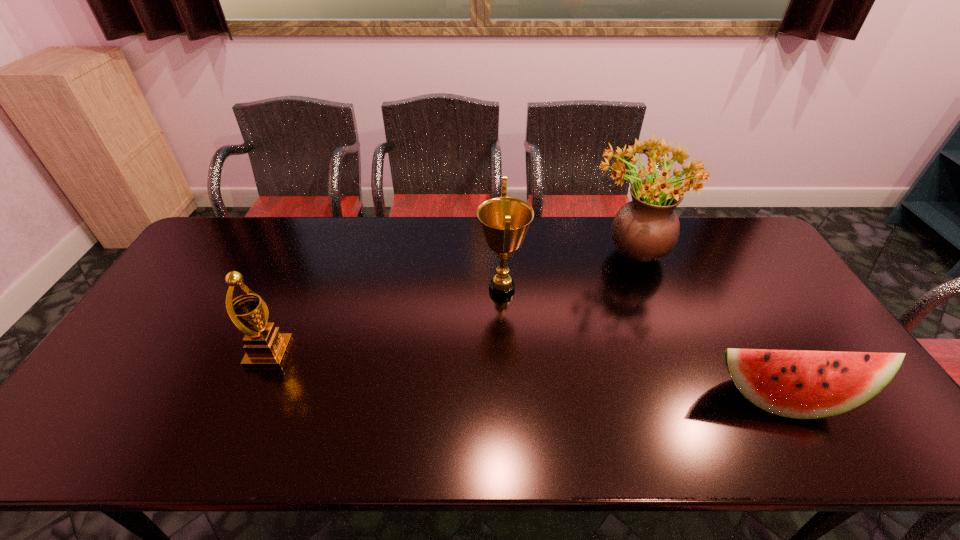
This screenshot has height=540, width=960. I want to click on vacant space located 0.200m on the front view with handles of the farther award, so click(412, 289).

Find the location of a particular element. The height and width of the screenshot is (540, 960). free space located 0.070m on the front-facing side of the third tallest object is located at coordinates (315, 353).

The width and height of the screenshot is (960, 540). I want to click on vacant area situated on the outer rind of the watermelon, so click(x=806, y=444).

Where is `object that is at the far edge`? This screenshot has height=540, width=960. object that is at the far edge is located at coordinates (646, 229).

Locate an element on the screen. The height and width of the screenshot is (540, 960). object that is at the near edge is located at coordinates (800, 384).

Where is `object present at the right edge`? object present at the right edge is located at coordinates (800, 384).

Identify the location of object that is at the near right corner. (800, 384).

You are a GUI agent. You are given a task and a screenshot of the screen. Output one action in this format:
    pyautogui.click(x=<x>, y=<y>)
    Task: Click on the free space at the far edge of the desktop
    The height and width of the screenshot is (540, 960).
    Given the screenshot: What is the action you would take?
    pyautogui.click(x=334, y=244)

What are the coordinates of `vacant space at the near edge of the desktop` in the screenshot? It's located at (297, 429).

Find the location of a particular element. The width and height of the screenshot is (960, 540). free space at the left edge of the desktop is located at coordinates (174, 329).